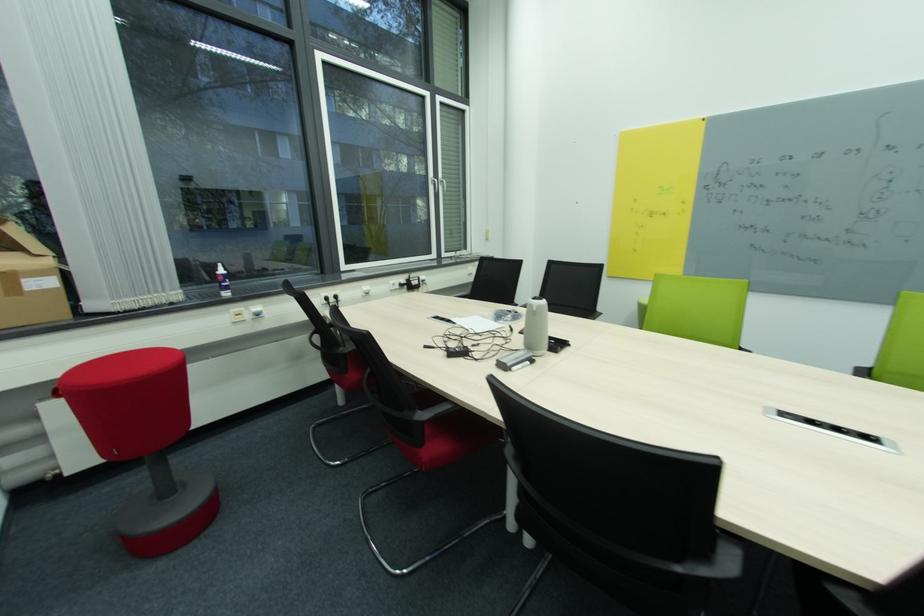
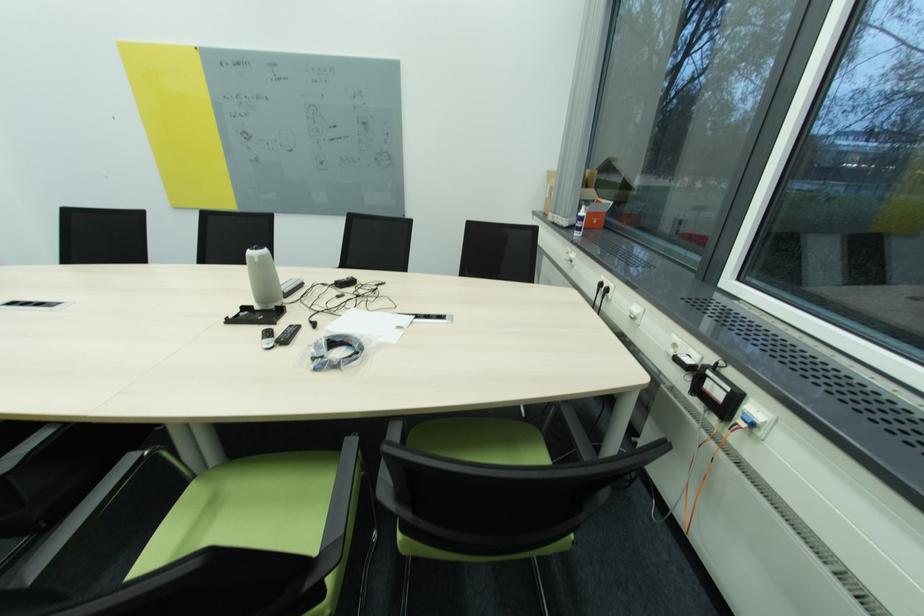
In the second image, find the point that corresponds to (x=332, y=300) in the first image.

(604, 286)